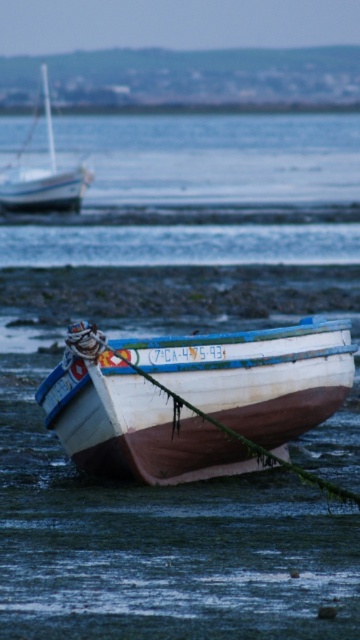
You are a sailor who wants to board the wooden boat at lower center and the white matte sailboat at upper left. Based on their positions, which boat is closer to the water?

The wooden boat at lower center is closer to the water than the white matte sailboat at upper left because it is positioned below it.

You are a photographer planning to capture both the wooden boat at lower center and the white matte sailboat at upper left in a single frame. Based on their positions, which boat should you position closer to the center of your camera viewfinder to include both in the frame without moving the camera?

The wooden boat at lower center should be positioned closer to the center of the camera viewfinder because it is to the right of the white matte sailboat at upper left, so centering it would help balance both boats within the frame.